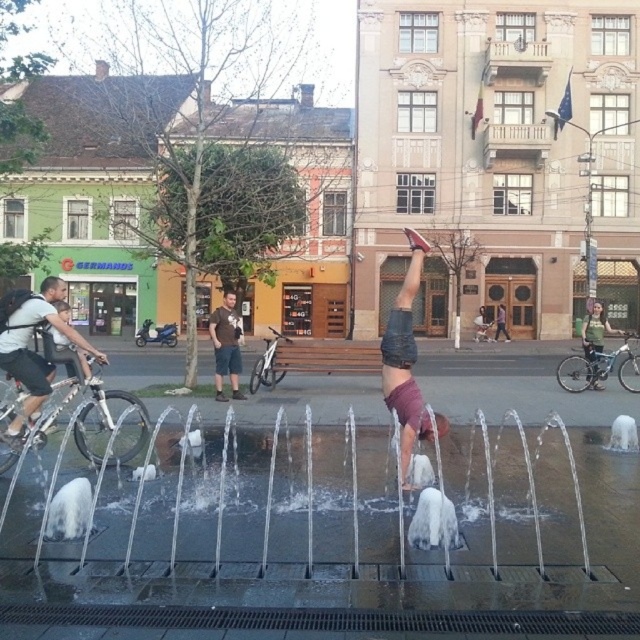
You are standing at the center of the fountain and want to reach the silver metallic bicycle at left. Which direction should you move in to get there?

The silver metallic bicycle at left is located at point (x=97, y=420), so you should move to the left to reach it.